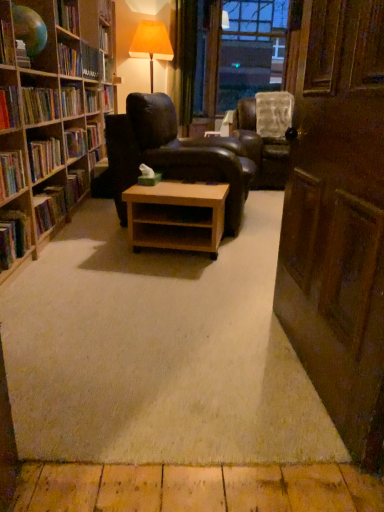
This screenshot has width=384, height=512. I want to click on vacant space behind wooden door at right, so click(229, 298).